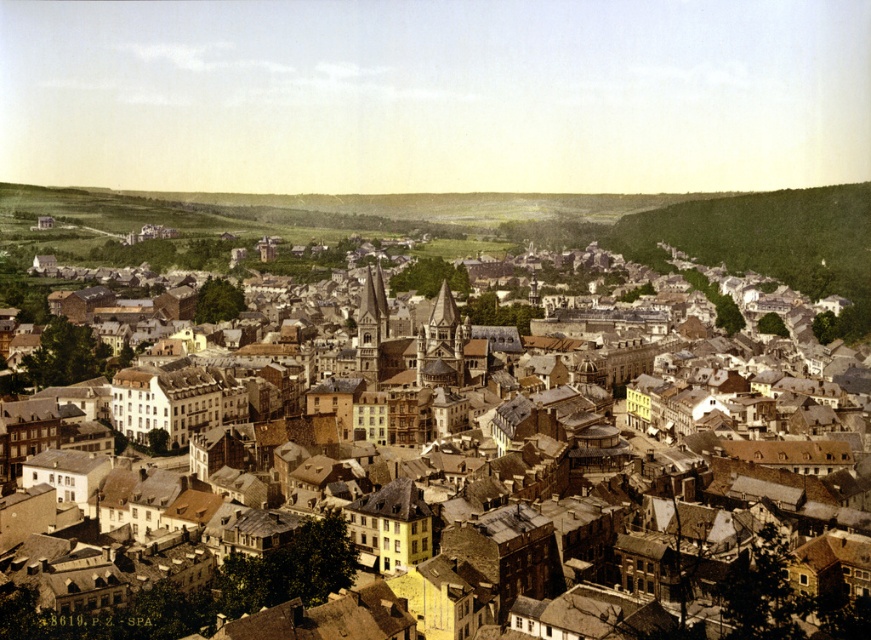
Question: Which point is closer to the camera taking this photo?

Choices:
 (A) (145, 602)
 (B) (620, 220)

Answer: (A)

Question: Can you confirm if brown stone buildings at center is positioned below green grassy hillside at upper right?

Choices:
 (A) no
 (B) yes

Answer: (B)

Question: Which of the following is the closest to the observer?

Choices:
 (A) (836, 266)
 (B) (32, 604)

Answer: (B)

Question: Considering the relative positions of brown stone buildings at center and green grassy hillside at upper right in the image provided, where is brown stone buildings at center located with respect to green grassy hillside at upper right?

Choices:
 (A) right
 (B) left

Answer: (B)

Question: Is brown stone buildings at center to the right of green grassy hillside at upper right from the viewer's perspective?

Choices:
 (A) no
 (B) yes

Answer: (A)